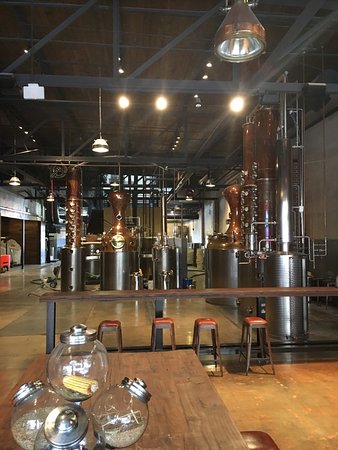
Image resolution: width=338 pixels, height=450 pixels. What are the coordinates of `hanging lights` in the screenshot? It's located at (247, 48), (103, 150), (14, 184), (51, 199).